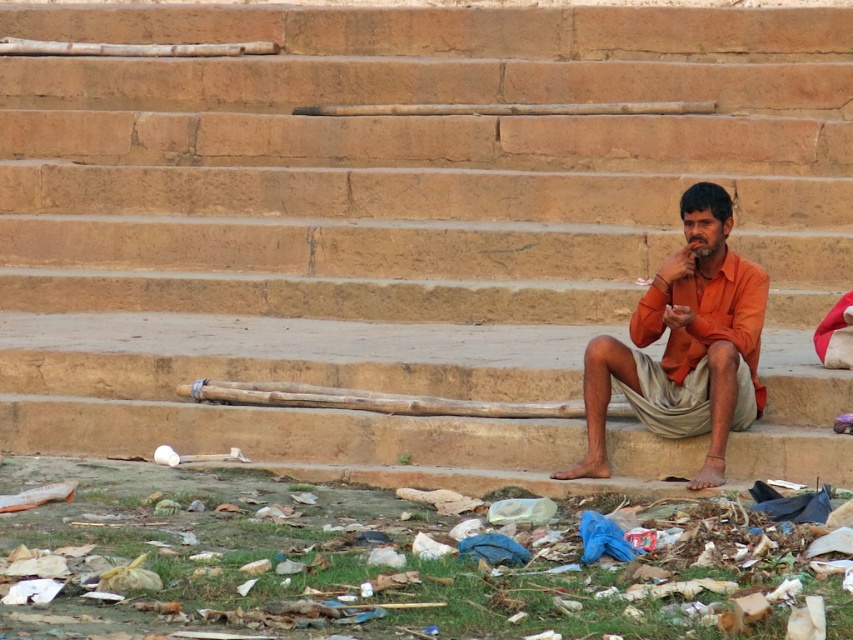
Question: Which point is farther to the camera?

Choices:
 (A) (28, 612)
 (B) (688, 352)

Answer: (B)

Question: In this image, where is plastic bag at lower center located relative to orange cotton shirt at center?

Choices:
 (A) right
 (B) left

Answer: (B)

Question: Does plastic bag at lower center appear over orange cotton shirt at center?

Choices:
 (A) yes
 (B) no

Answer: (B)

Question: Among these points, which one is nearest to the camera?

Choices:
 (A) (186, 598)
 (B) (718, 396)

Answer: (A)

Question: Can you confirm if plastic bag at lower center is bigger than orange cotton shirt at center?

Choices:
 (A) yes
 (B) no

Answer: (B)